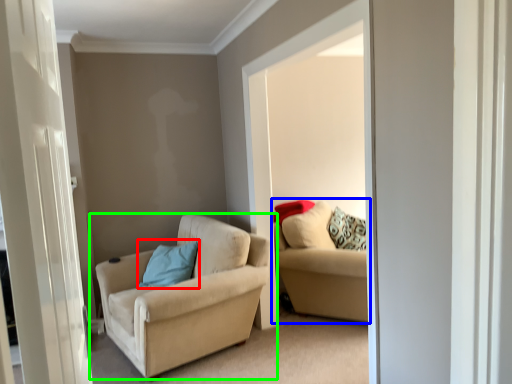
Question: Estimate the real-world distances between objects in this image. Which object is closer to pillow (highlighted by a red box), studio couch (highlighted by a blue box) or chair (highlighted by a green box)?

Choices:
 (A) studio couch
 (B) chair

Answer: (B)